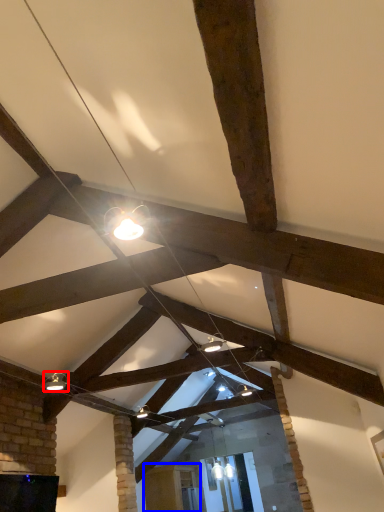
Question: Among these objects, which one is farthest to the camera, light fixture (highlighted by a red box) or furniture (highlighted by a blue box)?

Choices:
 (A) light fixture
 (B) furniture

Answer: (B)